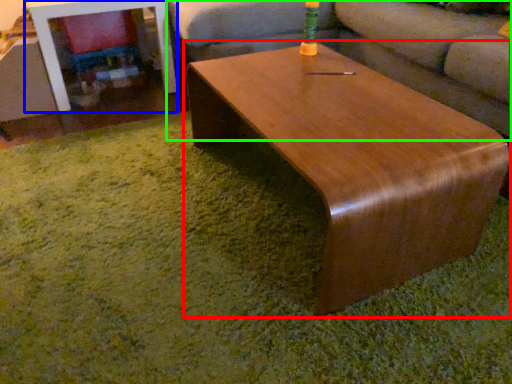
Question: Which is nearer to the coffee table (highlighted by a red box)? table (highlighted by a blue box) or studio couch (highlighted by a green box).

Choices:
 (A) table
 (B) studio couch

Answer: (B)